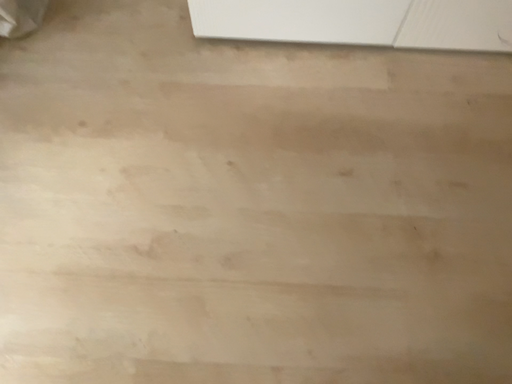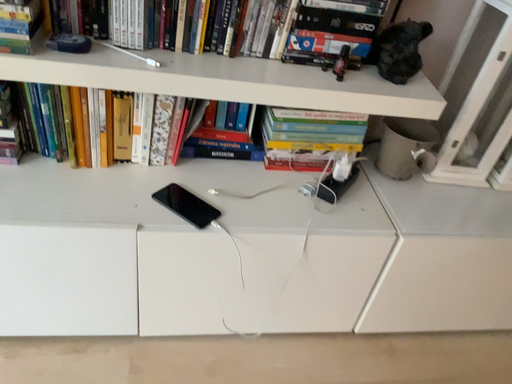
Question: How did the camera likely rotate when shooting the video?

Choices:
 (A) rotated upward
 (B) rotated downward

Answer: (A)